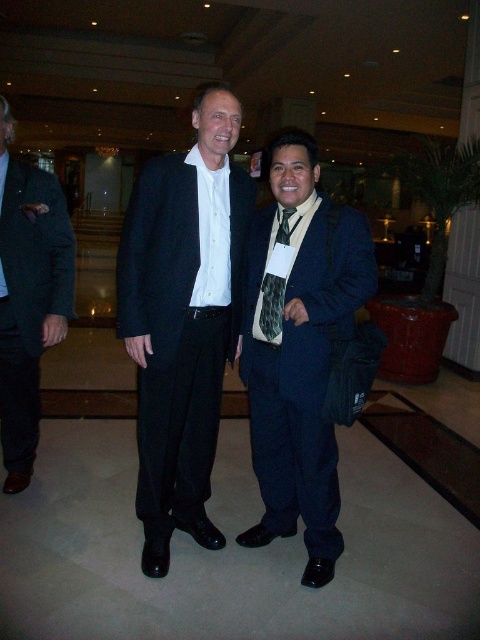
Which of these two, matte black suit at center or green textured tie at center, stands taller?

Standing taller between the two is matte black suit at center.

Can you confirm if matte black suit at center is positioned above green textured tie at center?

Incorrect, matte black suit at center is not positioned above green textured tie at center.

In order to click on matte black suit at center in this screenshot , I will do `click(182, 317)`.

Which is behind, point (349, 310) or point (33, 332)?

Positioned behind is point (33, 332).

Does navy blue suit at center have a lesser width compared to matte black suit at left?

In fact, navy blue suit at center might be wider than matte black suit at left.

Which is behind, point (265, 356) or point (1, 211)?

The point (1, 211) is more distant.

You are a GUI agent. You are given a task and a screenshot of the screen. Output one action in this format:
    pyautogui.click(x=<x>, y=<y>)
    Task: Click on the navy blue suit at center
    The image size is (480, 640).
    Given the screenshot: What is the action you would take?
    pyautogui.click(x=304, y=349)

Between matte black suit at left and green textured tie at center, which one appears on the left side from the viewer's perspective?

matte black suit at left is more to the left.

Can you confirm if matte black suit at left is thinner than green textured tie at center?

No, matte black suit at left is not thinner than green textured tie at center.

Where is `matte black suit at left`? matte black suit at left is located at coordinates click(28, 296).